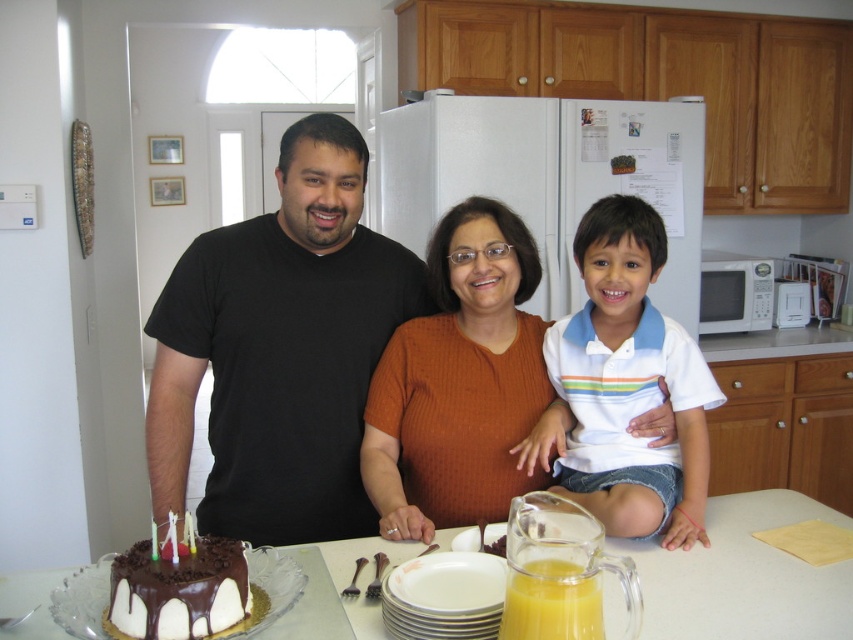
Can you confirm if white cotton shirt at center is shorter than white glossy table at center?

No.

Who is taller, white cotton shirt at center or white glossy table at center?

white cotton shirt at center is taller.

Measure the distance between white cotton shirt at center and camera.

white cotton shirt at center and camera are 4.73 feet apart.

Where is `white cotton shirt at center`? Image resolution: width=853 pixels, height=640 pixels. white cotton shirt at center is located at coordinates (630, 385).

Can you confirm if orange ribbed sweater at center is wider than white glossy microwave at right?

Correct, the width of orange ribbed sweater at center exceeds that of white glossy microwave at right.

Is point (546, 394) more distant than point (738, 264)?

No, it is not.

Find the location of `orange ribbed sweater at center`. orange ribbed sweater at center is located at coordinates (459, 381).

Between orange ribbed sweater at center and chocolate glaze cake at lower left, which one has more height?

orange ribbed sweater at center is taller.

Which is behind, point (534, 333) or point (148, 632)?

Point (534, 333)

Between point (469, 230) and point (213, 550), which one is positioned in front?

Positioned in front is point (213, 550).

Locate an element on the screen. Image resolution: width=853 pixels, height=640 pixels. orange ribbed sweater at center is located at coordinates (459, 381).